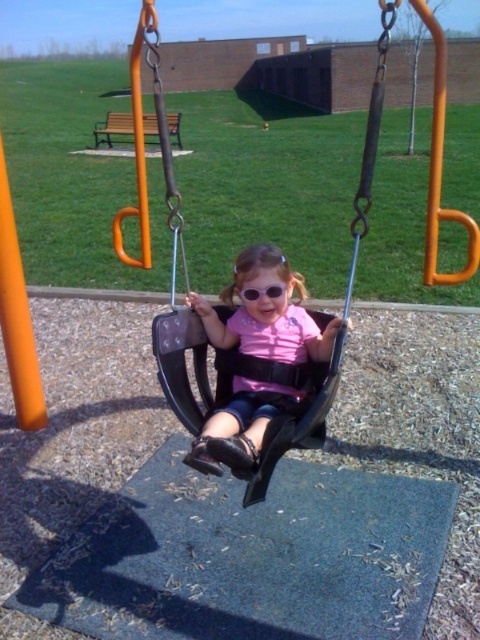
You are a parent at the playground. You notice your child is wearing transparent plastic goggles at center while sitting on the matte black swing at center. Are the goggles above or below the swing?

The matte black swing at center is positioned under transparent plastic goggles at center, so the goggles are above the swing.

You are standing at the origin point in the playground. There is a black plastic swing at center represented by point (230, 388). Can you tell me the coordinates of the black plastic swing at center?

The coordinates of the black plastic swing at center are point (230, 388).